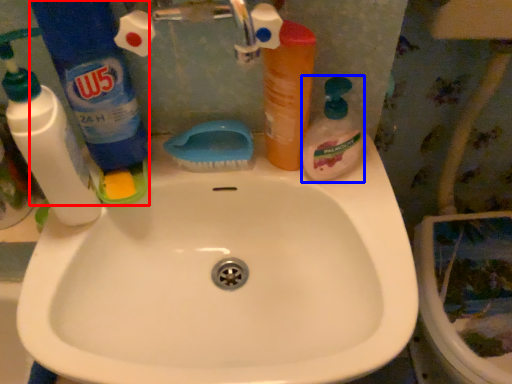
Question: Which point is further to the camera, cleaning product (highlighted by a red box) or cleaning product (highlighted by a blue box)?

Choices:
 (A) cleaning product
 (B) cleaning product

Answer: (B)